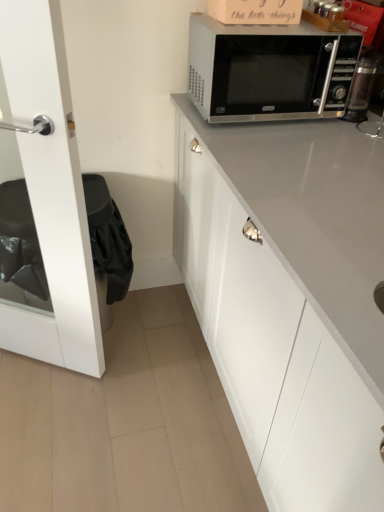
Question: Considering the relative positions of satin silver microwave at upper right and white glossy door at left in the image provided, is satin silver microwave at upper right to the left or to the right of white glossy door at left?

Choices:
 (A) right
 (B) left

Answer: (A)

Question: Relative to white glossy door at left, is satin silver microwave at upper right in front or behind?

Choices:
 (A) behind
 (B) front

Answer: (A)

Question: Is satin silver microwave at upper right wider or thinner than white glossy door at left?

Choices:
 (A) thin
 (B) wide

Answer: (B)

Question: Is white glossy door at left bigger or smaller than satin silver microwave at upper right?

Choices:
 (A) small
 (B) big

Answer: (B)

Question: Is white glossy door at left situated inside satin silver microwave at upper right or outside?

Choices:
 (A) inside
 (B) outside

Answer: (B)

Question: Considering the positions of point (67, 137) and point (296, 106), is point (67, 137) closer or farther from the camera than point (296, 106)?

Choices:
 (A) farther
 (B) closer

Answer: (B)

Question: From the image's perspective, is white glossy door at left above or below satin silver microwave at upper right?

Choices:
 (A) above
 (B) below

Answer: (B)